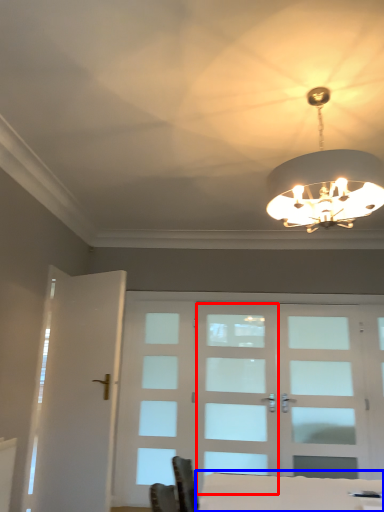
Question: Which object is further to the camera taking this photo, screen door (highlighted by a red box) or table (highlighted by a blue box)?

Choices:
 (A) screen door
 (B) table

Answer: (A)